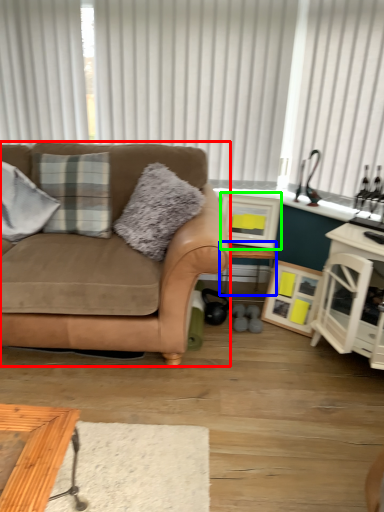
Question: Based on their relative distances, which object is farther from studio couch (highlighted by a red box)? Choose from table (highlighted by a blue box) and picture frame (highlighted by a green box).

Choices:
 (A) table
 (B) picture frame

Answer: (A)